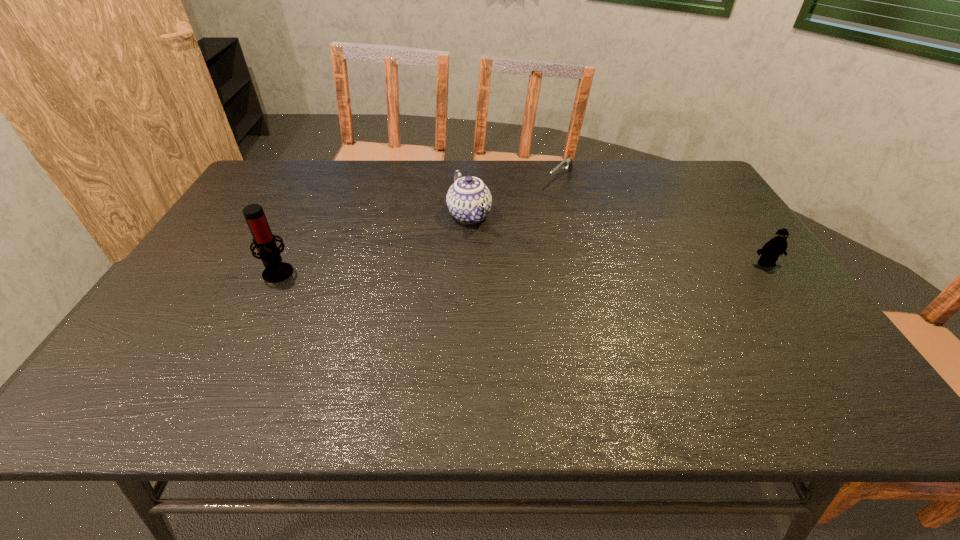
Where is `vacant space that is in between the farthest object and the chinaware`? vacant space that is in between the farthest object and the chinaware is located at coordinates (x=515, y=197).

Where is `empty space between the second tallest object and the Lego`? This screenshot has width=960, height=540. empty space between the second tallest object and the Lego is located at coordinates (617, 239).

The height and width of the screenshot is (540, 960). I want to click on free point between the Lego and the pistol, so click(x=663, y=221).

Identify the location of free space between the pistol and the second shortest object. The width and height of the screenshot is (960, 540). (663, 221).

Where is `vacant space in between the second shortest object and the third object from right to left`? The width and height of the screenshot is (960, 540). vacant space in between the second shortest object and the third object from right to left is located at coordinates (617, 239).

What are the coordinates of `free spot between the shortest object and the leftmost object` in the screenshot? It's located at (419, 226).

I want to click on object that is the closest to the chinaware, so pyautogui.click(x=567, y=162).

Identify which object is the second nearest to the rightmost object. Please provide its 2D coordinates. Your answer should be formatted as a tuple, i.e. [(x, y)], where the tuple contains the x and y coordinates of a point satisfying the conditions above.

[(469, 200)]